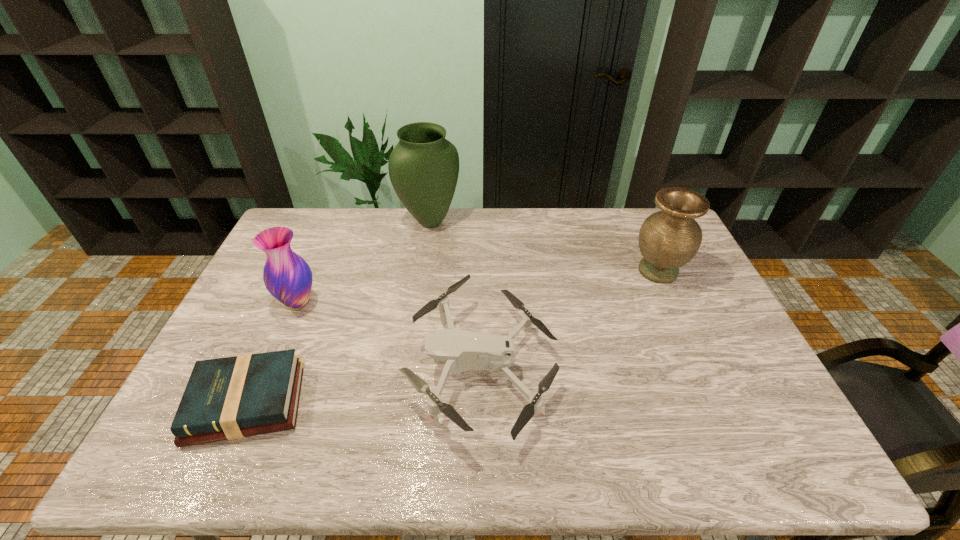
I want to click on free spot between the drone and the rightmost object, so click(570, 319).

Locate an element on the screen. free space between the hardback book and the second shortest object is located at coordinates (365, 384).

Locate an element on the screen. This screenshot has width=960, height=540. object that is the second closest to the fourth tallest object is located at coordinates (668, 239).

Select which object appears as the second closest to the rightmost vase. Please provide its 2D coordinates. Your answer should be formatted as a tuple, i.e. [(x, y)], where the tuple contains the x and y coordinates of a point satisfying the conditions above.

[(423, 167)]

Select which vase appears as the second closest to the rightmost vase. Please provide its 2D coordinates. Your answer should be formatted as a tuple, i.e. [(x, y)], where the tuple contains the x and y coordinates of a point satisfying the conditions above.

[(287, 276)]

Select which vase appears as the second closest to the second shortest object. Please provide its 2D coordinates. Your answer should be formatted as a tuple, i.e. [(x, y)], where the tuple contains the x and y coordinates of a point satisfying the conditions above.

[(287, 276)]

Find the location of a particular element. The image size is (960, 540). vacant area in the image that satisfies the following two spatial constraints: 1. on the back side of the rightmost vase; 2. on the left side of the leftmost vase is located at coordinates (311, 271).

At what (x,y) coordinates should I click in order to perform the action: click on free spot that satisfies the following two spatial constraints: 1. on the back side of the leftmost vase; 2. on the right side of the farthest object. Please return your answer as a coordinate pair (x, y). Looking at the image, I should click on (333, 221).

Locate an element on the screen. The width and height of the screenshot is (960, 540). free point that satisfies the following two spatial constraints: 1. on the back side of the shortest object; 2. on the left side of the tallest object is located at coordinates [x=327, y=221].